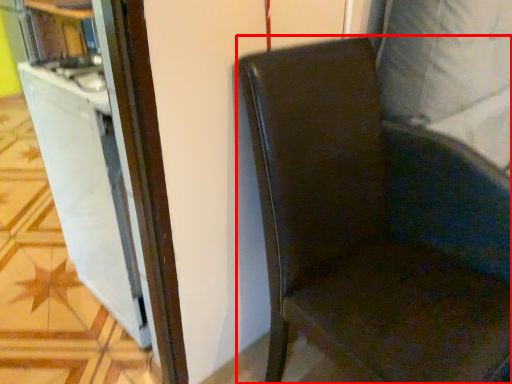
Question: From the image's perspective, what is the correct spatial positioning of chair (annotated by the red box) in reference to file cabinet?

Choices:
 (A) above
 (B) below

Answer: (B)